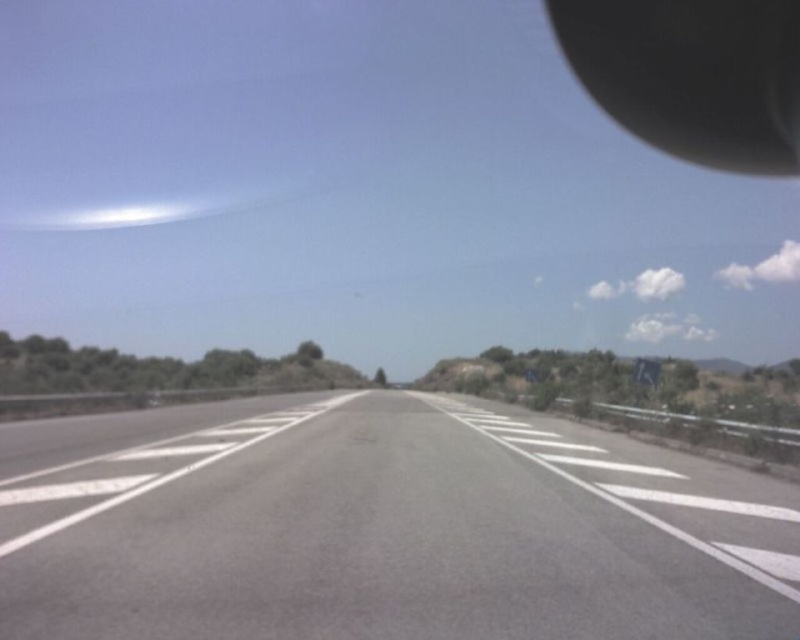
You are driving a car and want to check your rearview mirror while keeping your eyes on the road ahead. Which object is closer to you, the gray asphalt highway at center or the black rubber rearview mirror at upper right?

Answer: The gray asphalt highway at center is closer to the viewer than the black rubber rearview mirror at upper right, so the gray asphalt highway at center is closer.

You are a driver approaching the gray asphalt highway at center and the black rubber rearview mirror at upper right. Which object is closer to the left side of your view?

The gray asphalt highway at center is positioned on the left side of black rubber rearview mirror at upper right, so it is closer to the left side of your view.

In the scene shown: You are a drone operator trying to capture a photo of the gray asphalt highway at center. Your camera has a crosshair that can be positioned at any coordinate on the image. To ensure the highway is centered in the photo, where should you place the crosshair?

The 2D location of gray asphalt highway at center is at point (382,528), so you should place the crosshair at coordinates (382,528) to center the highway in the photo.